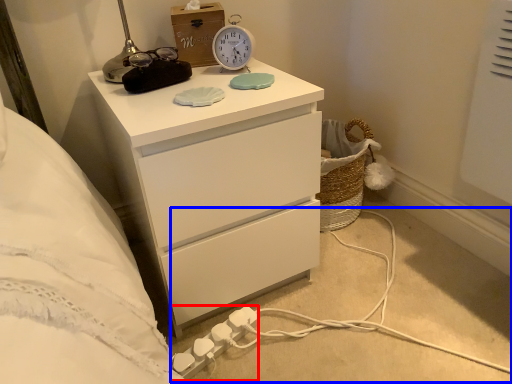
Question: Which point is closer to the camera, extension cord (highlighted by a red box) or cable (highlighted by a blue box)?

Choices:
 (A) extension cord
 (B) cable

Answer: (B)